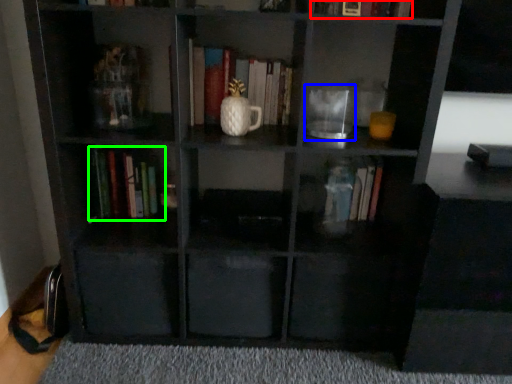
Question: Which object is the closest to the book (highlighted by a red box)? Choose among these: glass jar (highlighted by a blue box) or book (highlighted by a green box).

Choices:
 (A) glass jar
 (B) book

Answer: (A)